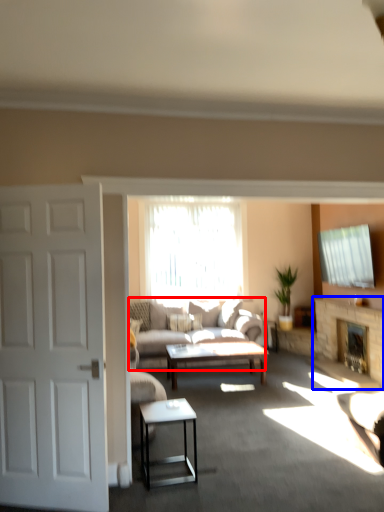
Question: Among these objects, which one is nearest to the camera, studio couch (highlighted by a red box) or fireplace (highlighted by a blue box)?

Choices:
 (A) studio couch
 (B) fireplace

Answer: (A)